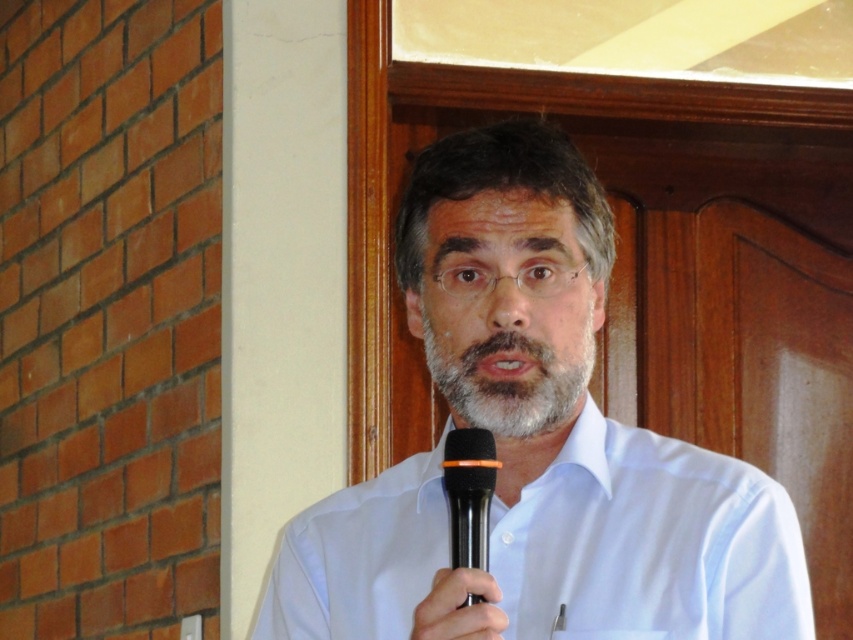
Question: Is white matte shirt at center positioned in front of matte black microphone at center?

Choices:
 (A) yes
 (B) no

Answer: (B)

Question: Which is nearer to the gray matte beard at center?

Choices:
 (A) black plastic microphone at center
 (B) white matte shirt at center
 (C) white smooth shirt at center

Answer: (B)

Question: Does white smooth shirt at center appear over black plastic microphone at center?

Choices:
 (A) yes
 (B) no

Answer: (B)

Question: Can you confirm if white smooth shirt at center is bigger than gray matte beard at center?

Choices:
 (A) no
 (B) yes

Answer: (B)

Question: Which object is positioned closest to the white smooth shirt at center?

Choices:
 (A) black plastic microphone at center
 (B) gray matte beard at center
 (C) white matte shirt at center
 (D) matte black microphone at center

Answer: (C)

Question: Which object appears closest to the camera in this image?

Choices:
 (A) gray matte beard at center
 (B) white smooth shirt at center

Answer: (B)